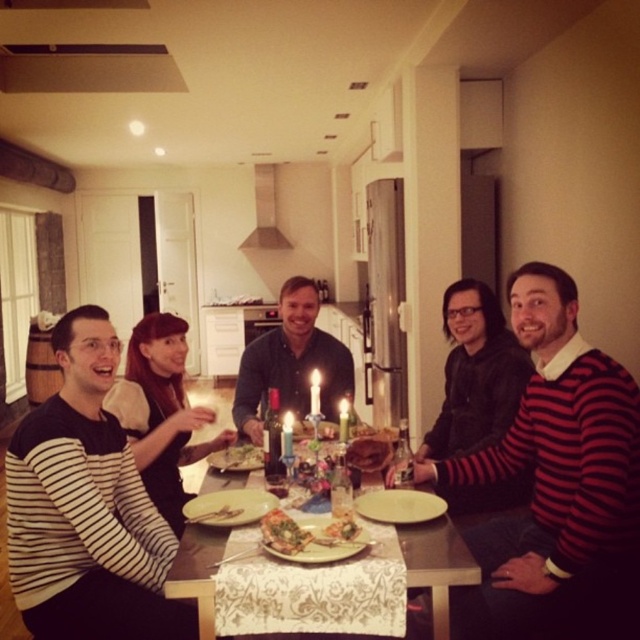
You are a photographer standing at the entrance of the kitchen. You want to take a photo of the striped sweater at center so that it appears in focus. The camera you are using has a minimum focusing distance of 5 feet. Will you be able to take the photo without moving closer?

The distance of striped sweater at center from camera is 5.30 feet, which is just above the camera minimum focusing distance of 5 feet. Therefore, you can take the photo without moving closer.

You are standing at the dining table in the scene. You notice two points marked on the floor. The first point is at coordinate point(x=616, y=467) and the second is at point(x=269, y=378). If you want to walk towards the point that is closer to you, which coordinate should you head towards?

You should head towards point(x=269, y=378) because it is closer to you than point(x=616, y=467).

You are a guest at the dinner table and want to reach for the golden crispy chicken at center and the golden crispy pizza at center. Which one is closer to you?

The golden crispy chicken at center is closer to you because it is located below the golden crispy pizza at center, which is further away.